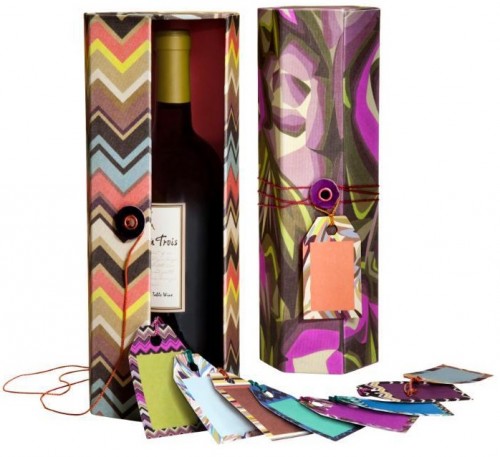
Locate an element on the screen. The image size is (500, 457). colorful wine bottle gift boxes is located at coordinates (100, 29), (282, 23).